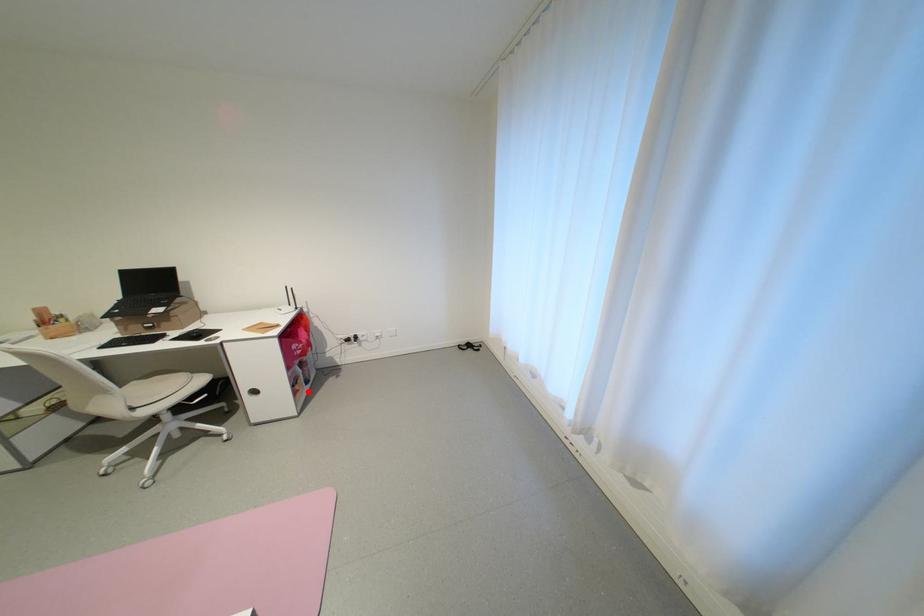
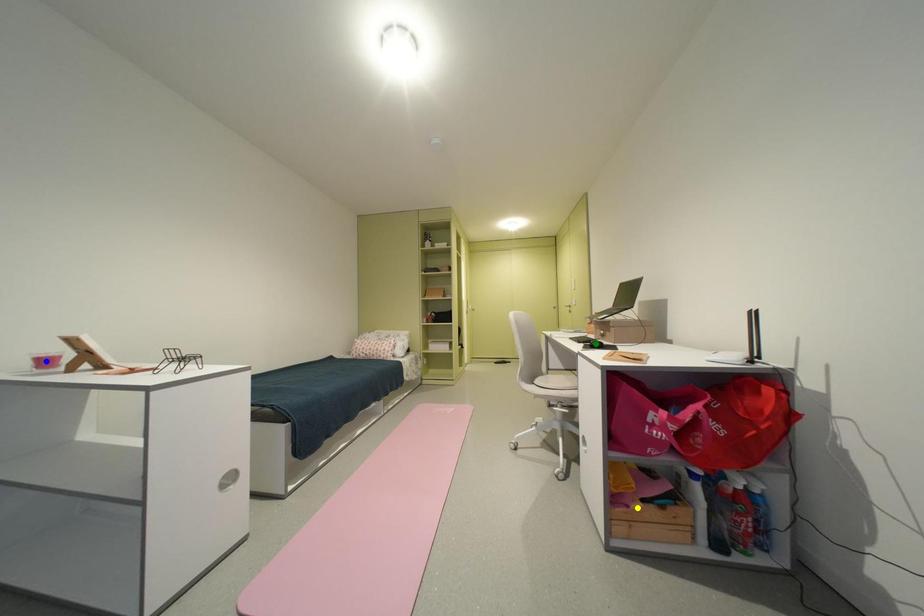
Question: I am providing you with two images of the same scene from different viewpoints. A red point is marked on the first image. You are given multiple points on the second image. Which point in image 2 is actually the same real-world point as the red point in image 1?

Choices:
 (A) green point
 (B) yellow point
 (C) blue point

Answer: (B)